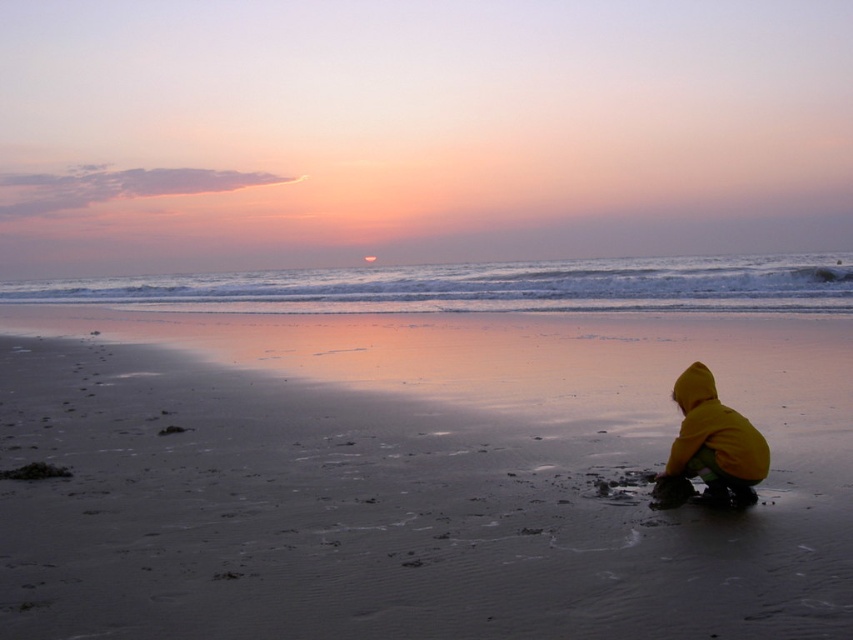
You are standing on the sandy beach at lower right and want to walk to the yellow fabric child at lower right. Since the sandy beach is wider than the child, can you easily navigate around the child to reach the water without stepping on them?

The sandy beach at lower right is wider than the yellow fabric child at lower right, so you can easily navigate around the child to reach the water without stepping on them.

You are a photographer trying to capture the sunset scene. You notice the sandy beach at lower right and the yellow fabric child at lower right in your frame. Based on their positions, which object should appear closer to the bottom edge of your photo?

The yellow fabric child at lower right should appear closer to the bottom edge of the photo because the sandy beach at lower right is located above it.